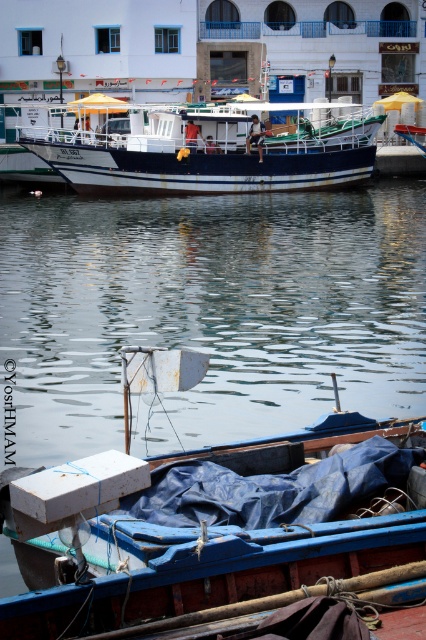
You are a photographer planning to take a photo of the waterfront scene. You want to ensure both the blue tarpaulin boat at lower center and the white glossy boat at center are clearly visible. Which boat should you focus on first to ensure proper framing?

The blue tarpaulin boat at lower center is shorter than the white glossy boat at center, so you should focus on the white glossy boat at center first to ensure it occupies the frame properly.